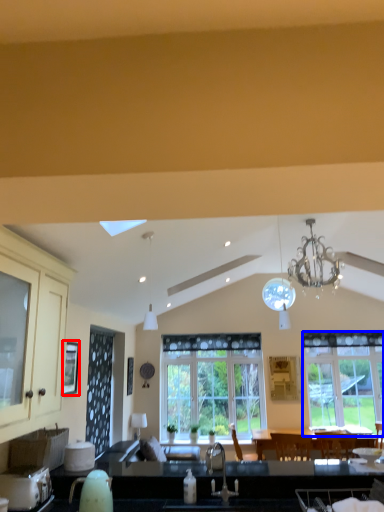
Question: Which object is further to the camera taking this photo, window screen (highlighted by a red box) or window (highlighted by a blue box)?

Choices:
 (A) window screen
 (B) window

Answer: (B)